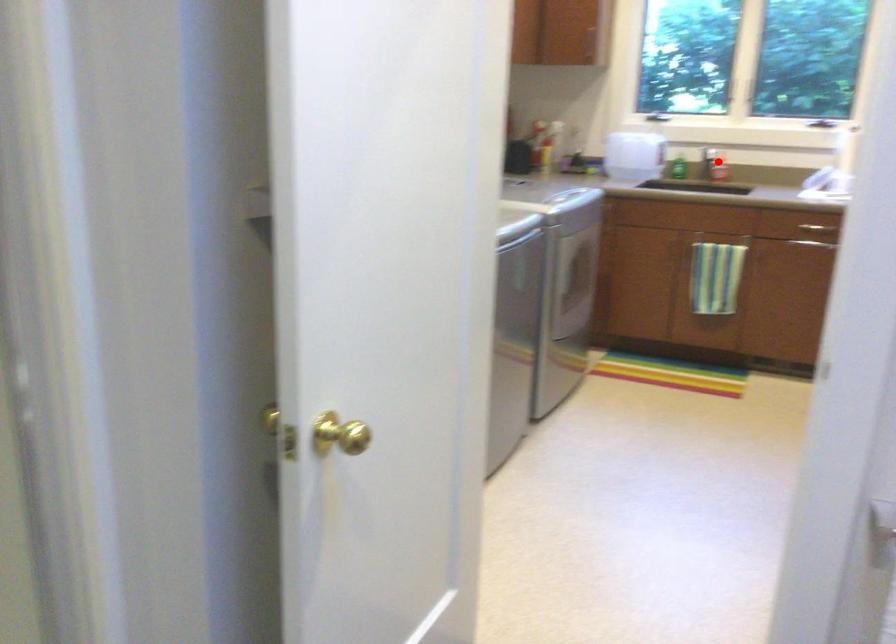
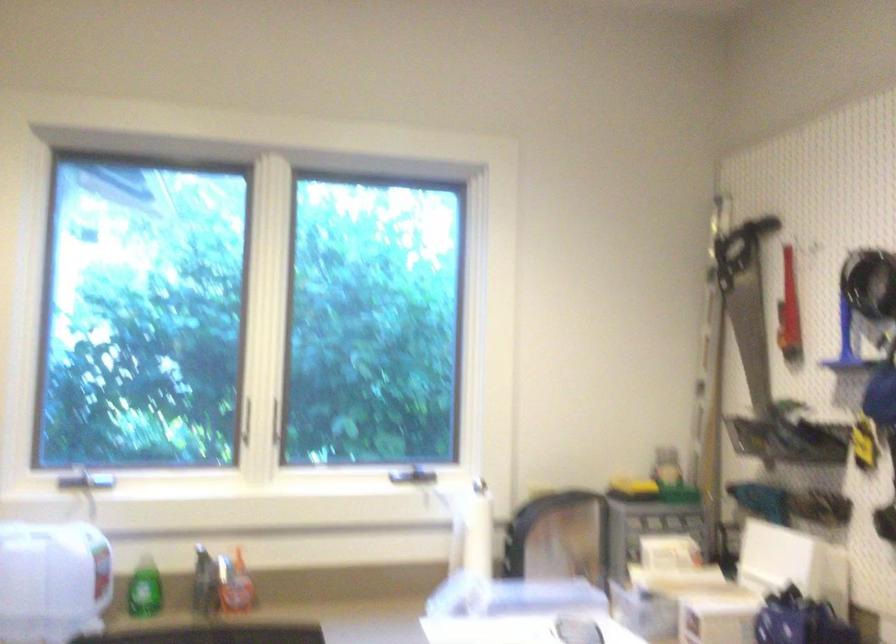
The point at the highlighted location is marked in the first image. Where is the corresponding point in the second image?

(234, 583)